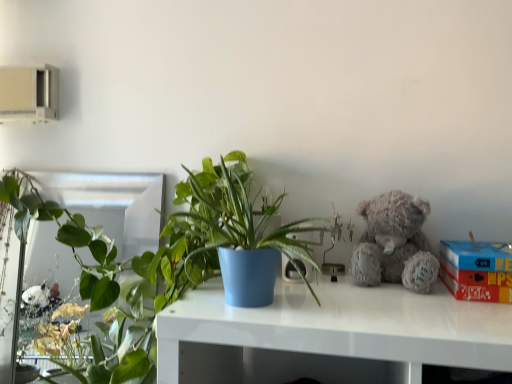
Question: Is green glossy plant at left, the 2th houseplant from the right, shorter than red cardboard box at right?

Choices:
 (A) yes
 (B) no

Answer: (B)

Question: Is green glossy plant at left, which is counted as the second houseplant, starting from the front, outside red cardboard box at right?

Choices:
 (A) no
 (B) yes

Answer: (B)

Question: Is green glossy plant at left, which is counted as the second houseplant, starting from the front, surrounding red cardboard box at right?

Choices:
 (A) no
 (B) yes

Answer: (A)

Question: From a real-world perspective, is green glossy plant at left, acting as the 1th houseplant starting from the left, located higher than red cardboard box at right?

Choices:
 (A) no
 (B) yes

Answer: (A)

Question: Is red cardboard box at right at the back of green glossy plant at left, acting as the 1th houseplant starting from the left?

Choices:
 (A) yes
 (B) no

Answer: (B)

Question: Considering the relative positions of red cardboard box at right and fuzzy gray teddy bear at upper right in the image provided, is red cardboard box at right to the left of fuzzy gray teddy bear at upper right from the viewer's perspective?

Choices:
 (A) no
 (B) yes

Answer: (A)

Question: Considering the relative sizes of red cardboard box at right and fuzzy gray teddy bear at upper right in the image provided, is red cardboard box at right bigger than fuzzy gray teddy bear at upper right?

Choices:
 (A) yes
 (B) no

Answer: (A)

Question: Is the position of red cardboard box at right less distant than that of fuzzy gray teddy bear at upper right?

Choices:
 (A) no
 (B) yes

Answer: (B)

Question: Is red cardboard box at right positioned beyond the bounds of fuzzy gray teddy bear at upper right?

Choices:
 (A) yes
 (B) no

Answer: (A)

Question: From the image's perspective, is red cardboard box at right located beneath fuzzy gray teddy bear at upper right?

Choices:
 (A) no
 (B) yes

Answer: (B)

Question: Is fuzzy gray teddy bear at upper right a part of red cardboard box at right?

Choices:
 (A) yes
 (B) no

Answer: (B)

Question: Is green glossy plant at left, the 2th houseplant from the right, facing towards matte blue pot at center, acting as the first houseplant starting from the front?

Choices:
 (A) no
 (B) yes

Answer: (A)